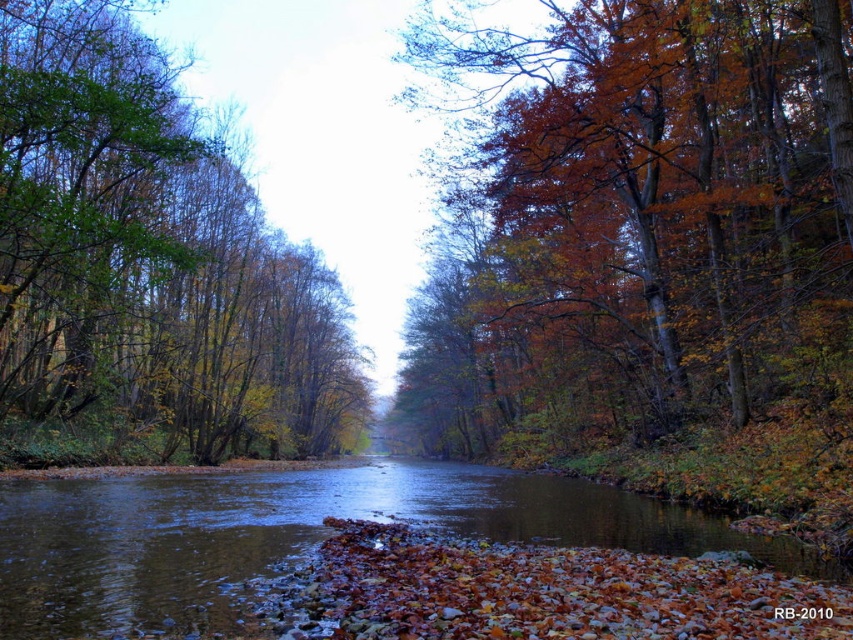
From the picture: Is green leafy tree at left to the left of brown smooth water at center from the viewer's perspective?

Indeed, green leafy tree at left is positioned on the left side of brown smooth water at center.

Identify the location of green leafy tree at left. The width and height of the screenshot is (853, 640). (148, 266).

Is autumn leaves at right below green leafy tree at left?

Actually, autumn leaves at right is above green leafy tree at left.

Is point (572, 392) closer to viewer compared to point (85, 406)?

Yes, point (572, 392) is closer to viewer.

The width and height of the screenshot is (853, 640). What do you see at coordinates (633, 216) in the screenshot? I see `autumn leaves at right` at bounding box center [633, 216].

You are a GUI agent. You are given a task and a screenshot of the screen. Output one action in this format:
    pyautogui.click(x=<x>, y=<y>)
    Task: Click on the autumn leaves at right
    
    Given the screenshot: What is the action you would take?
    pyautogui.click(x=633, y=216)

Between autumn leaves at right and brown smooth water at center, which one appears on the left side from the viewer's perspective?

brown smooth water at center

Is point (833, 12) positioned in front of point (486, 499)?

Yes, point (833, 12) is in front of point (486, 499).

Identify the location of autumn leaves at right. This screenshot has width=853, height=640. (633, 216).